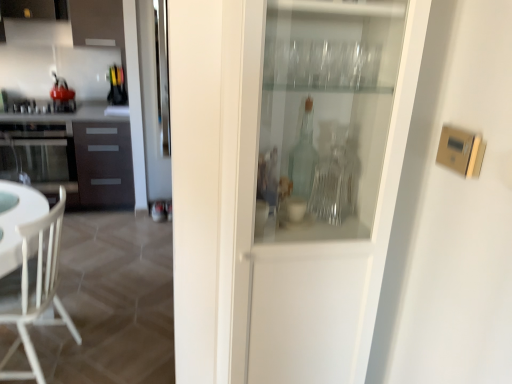
This screenshot has width=512, height=384. I want to click on transparent glass cabinet at center, so click(x=333, y=269).

Where is `white wood chair at lower left`? The height and width of the screenshot is (384, 512). white wood chair at lower left is located at coordinates (38, 291).

How much space does metallic silver stove at left, the first appliance in the bottom-to-top sequence, occupy horizontally?

It is 22.00 inches.

What do you see at coordinates (62, 96) in the screenshot? I see `shiny red kettle at left, which ranks as the first appliance in top-to-bottom order` at bounding box center [62, 96].

Identify the location of transparent glass cabinet at center. (333, 269).

Which is in front, transparent glass cabinet at center or metallic silver stove at left, the first appliance in the bottom-to-top sequence?

transparent glass cabinet at center.

Is transparent glass cabinet at center bigger or smaller than metallic silver stove at left, marked as the 2th appliance in a top-to-bottom arrangement?

Considering their sizes, transparent glass cabinet at center takes up more space than metallic silver stove at left, marked as the 2th appliance in a top-to-bottom arrangement.

From the image's perspective, is transparent glass cabinet at center above or below metallic silver stove at left, marked as the 2th appliance in a top-to-bottom arrangement?

From the image's perspective, transparent glass cabinet at center appears below metallic silver stove at left, marked as the 2th appliance in a top-to-bottom arrangement.

Which of these two, transparent glass cabinet at center or metallic silver stove at left, marked as the 2th appliance in a top-to-bottom arrangement, is thinner?

With smaller width is transparent glass cabinet at center.

Can white wood chair at lower left be found inside metallic silver stove at left, the first appliance in the bottom-to-top sequence?

No, white wood chair at lower left is located outside of metallic silver stove at left, the first appliance in the bottom-to-top sequence.

Between metallic silver stove at left, the first appliance in the bottom-to-top sequence, and white wood chair at lower left, which one has larger size?

With larger size is white wood chair at lower left.

Is the surface of metallic silver stove at left, the first appliance in the bottom-to-top sequence, in direct contact with white wood chair at lower left?

No, metallic silver stove at left, the first appliance in the bottom-to-top sequence, is not next to white wood chair at lower left.

Does metallic silver stove at left, the first appliance in the bottom-to-top sequence, have a lesser width compared to white wood chair at lower left?

Indeed, metallic silver stove at left, the first appliance in the bottom-to-top sequence, has a lesser width compared to white wood chair at lower left.

Between point (402, 165) and point (69, 170), which one is positioned behind?

The point (69, 170) is farther.

Consider the image. Does transparent glass cabinet at center have a lesser width compared to satin black oven at left?

Yes, transparent glass cabinet at center is thinner than satin black oven at left.

Between transparent glass cabinet at center and satin black oven at left, which one appears on the left side from the viewer's perspective?

satin black oven at left.

Looking at this image, is transparent glass cabinet at center aimed at satin black oven at left?

No, transparent glass cabinet at center does not turn towards satin black oven at left.

Which object is closer to the camera, satin black oven at left or white wood chair at lower left?

white wood chair at lower left is closer to the camera.

Is satin black oven at left at the left side of white wood chair at lower left?

Indeed, satin black oven at left is positioned on the left side of white wood chair at lower left.

From the image's perspective, would you say satin black oven at left is positioned over white wood chair at lower left?

Indeed, from the image's perspective, satin black oven at left is shown above white wood chair at lower left.

Is satin black oven at left completely or partially outside of white wood chair at lower left?

Absolutely, satin black oven at left is external to white wood chair at lower left.

Consider the image. Is shiny red kettle at left, positioned as the 2th appliance in bottom-to-top order, not within metallic silver stove at left, the first appliance in the bottom-to-top sequence?

Indeed, shiny red kettle at left, positioned as the 2th appliance in bottom-to-top order, is completely outside metallic silver stove at left, the first appliance in the bottom-to-top sequence.

Is shiny red kettle at left, positioned as the 2th appliance in bottom-to-top order, positioned with its back to metallic silver stove at left, the first appliance in the bottom-to-top sequence?

That's not correct — shiny red kettle at left, positioned as the 2th appliance in bottom-to-top order, is not looking away from metallic silver stove at left, the first appliance in the bottom-to-top sequence.

Locate an element on the screen. Image resolution: width=512 pixels, height=384 pixels. appliance on the left side of shiny red kettle at left, positioned as the 2th appliance in bottom-to-top order is located at coordinates (44, 106).

Does point (53, 86) come behind point (36, 107)?

Yes, point (53, 86) is behind point (36, 107).

In the scene shown: From the image's perspective, is white wood chair at lower left on top of shiny red kettle at left, positioned as the 2th appliance in bottom-to-top order?

No, from the image's perspective, white wood chair at lower left is not above shiny red kettle at left, positioned as the 2th appliance in bottom-to-top order.

Image resolution: width=512 pixels, height=384 pixels. Find the location of `chair to the right of shiny red kettle at left, positioned as the 2th appliance in bottom-to-top order`. chair to the right of shiny red kettle at left, positioned as the 2th appliance in bottom-to-top order is located at coordinates (38, 291).

Which is more to the left, white wood chair at lower left or shiny red kettle at left, positioned as the 2th appliance in bottom-to-top order?

shiny red kettle at left, positioned as the 2th appliance in bottom-to-top order.

Can you confirm if white wood chair at lower left is smaller than shiny red kettle at left, which ranks as the first appliance in top-to-bottom order?

Incorrect, white wood chair at lower left is not smaller in size than shiny red kettle at left, which ranks as the first appliance in top-to-bottom order.

Looking at this image, in the image, is dark brown wood cabinet at left positioned in front of or behind metallic silver stove at left, marked as the 2th appliance in a top-to-bottom arrangement?

Clearly, dark brown wood cabinet at left is in front of metallic silver stove at left, marked as the 2th appliance in a top-to-bottom arrangement.

What's the angular difference between dark brown wood cabinet at left and metallic silver stove at left, the first appliance in the bottom-to-top sequence,'s facing directions?

dark brown wood cabinet at left and metallic silver stove at left, the first appliance in the bottom-to-top sequence, are facing 6.25e-05 degrees away from each other.

Is metallic silver stove at left, marked as the 2th appliance in a top-to-bottom arrangement, a part of dark brown wood cabinet at left?

Yes.

From the image's perspective, is dark brown wood cabinet at left above or below metallic silver stove at left, the first appliance in the bottom-to-top sequence?

dark brown wood cabinet at left is below metallic silver stove at left, the first appliance in the bottom-to-top sequence.

You are a GUI agent. You are given a task and a screenshot of the screen. Output one action in this format:
    pyautogui.click(x=<x>, y=<y>)
    Task: Click on the appliance directly beneath the transparent glass cabinet at center (from a real-world perspective)
    This screenshot has width=512, height=384.
    Given the screenshot: What is the action you would take?
    pyautogui.click(x=44, y=106)

Where is `chair lying in front of the metallic silver stove at left, the first appliance in the bottom-to-top sequence`? This screenshot has height=384, width=512. chair lying in front of the metallic silver stove at left, the first appliance in the bottom-to-top sequence is located at coordinates (38, 291).

Based on their spatial positions, is shiny red kettle at left, positioned as the 2th appliance in bottom-to-top order, or white wood chair at lower left further from transparent glass cabinet at center?

The object further to transparent glass cabinet at center is shiny red kettle at left, positioned as the 2th appliance in bottom-to-top order.

When comparing their distances from white wood chair at lower left, does shiny red kettle at left, positioned as the 2th appliance in bottom-to-top order, or transparent glass cabinet at center seem closer?

transparent glass cabinet at center is closer to white wood chair at lower left.

Which object lies nearer to the anchor point metallic silver stove at left, marked as the 2th appliance in a top-to-bottom arrangement, dark brown wood cabinet at left or satin black oven at left?

satin black oven at left is positioned closer to the anchor metallic silver stove at left, marked as the 2th appliance in a top-to-bottom arrangement.

From the picture: Estimate the real-world distances between objects in this image. Which object is closer to dark brown wood cabinet at left, satin black oven at left or transparent glass cabinet at center?

The object closer to dark brown wood cabinet at left is satin black oven at left.

Which object lies further to the anchor point satin black oven at left, shiny red kettle at left, which ranks as the first appliance in top-to-bottom order, or white wood chair at lower left?

Based on the image, white wood chair at lower left appears to be further to satin black oven at left.

Estimate the real-world distances between objects in this image. Which object is closer to shiny red kettle at left, which ranks as the first appliance in top-to-bottom order, satin black oven at left or dark brown wood cabinet at left?

satin black oven at left is closer to shiny red kettle at left, which ranks as the first appliance in top-to-bottom order.

Based on the photo, when comparing their distances from shiny red kettle at left, which ranks as the first appliance in top-to-bottom order, does dark brown wood cabinet at left or white wood chair at lower left seem closer?

The object closer to shiny red kettle at left, which ranks as the first appliance in top-to-bottom order, is dark brown wood cabinet at left.

Based on their spatial positions, is satin black oven at left or transparent glass cabinet at center closer to metallic silver stove at left, marked as the 2th appliance in a top-to-bottom arrangement?

satin black oven at left is closer to metallic silver stove at left, marked as the 2th appliance in a top-to-bottom arrangement.

What are the coordinates of `cabinetry located between transparent glass cabinet at center and shiny red kettle at left, which ranks as the first appliance in top-to-bottom order, in the depth direction` in the screenshot? It's located at (79, 153).

This screenshot has width=512, height=384. Find the location of `oven located between transparent glass cabinet at center and shiny red kettle at left, positioned as the 2th appliance in bottom-to-top order, in the depth direction`. oven located between transparent glass cabinet at center and shiny red kettle at left, positioned as the 2th appliance in bottom-to-top order, in the depth direction is located at coordinates (38, 152).

Locate an element on the screen. appliance between shiny red kettle at left, positioned as the 2th appliance in bottom-to-top order, and dark brown wood cabinet at left, in the vertical direction is located at coordinates (44, 106).

Find the location of a particular element. This screenshot has width=512, height=384. chair between transparent glass cabinet at center and satin black oven at left along the z-axis is located at coordinates (38, 291).